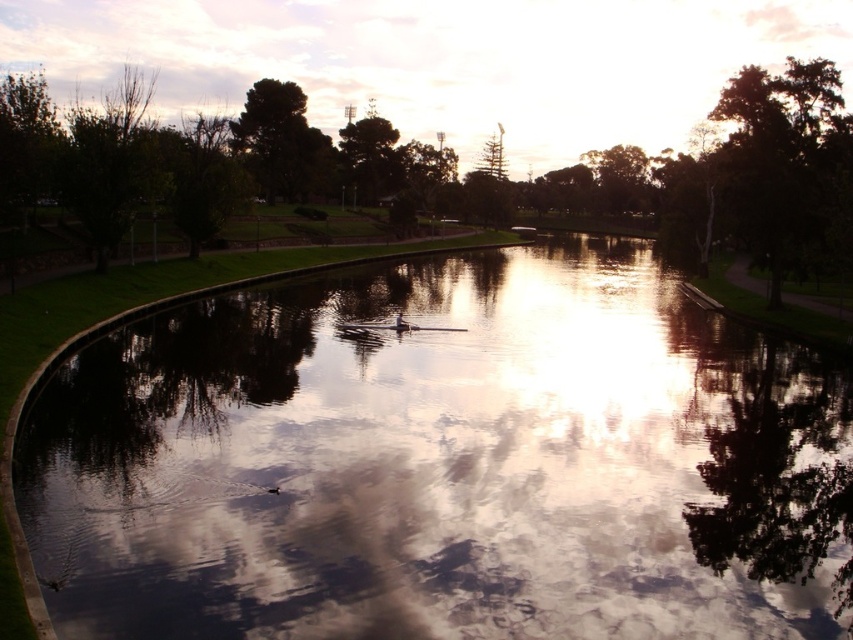
In the scene shown: You are standing at the edge of the water in the park scene. You want to know which tree, the green leafy tree at center or the green leafy tree at upper right, is taller. Can you tell me which one is taller?

The green leafy tree at center is taller than the green leafy tree at upper right according to the description.

Consider the image. You are an artist wanting to paint the scene. You notice the glossy reflective water at center and the green leafy tree at upper right. Which object is closer to the viewer?

The glossy reflective water at center is positioned under the green leafy tree at upper right, so the green leafy tree at upper right is closer to the viewer.

You are standing at the edge of the water and see the green leafy tree at center and the green leafy tree at upper right. Which tree is positioned higher in the image?

The green leafy tree at center is located above the green leafy tree at upper right, so it is positioned higher in the image.